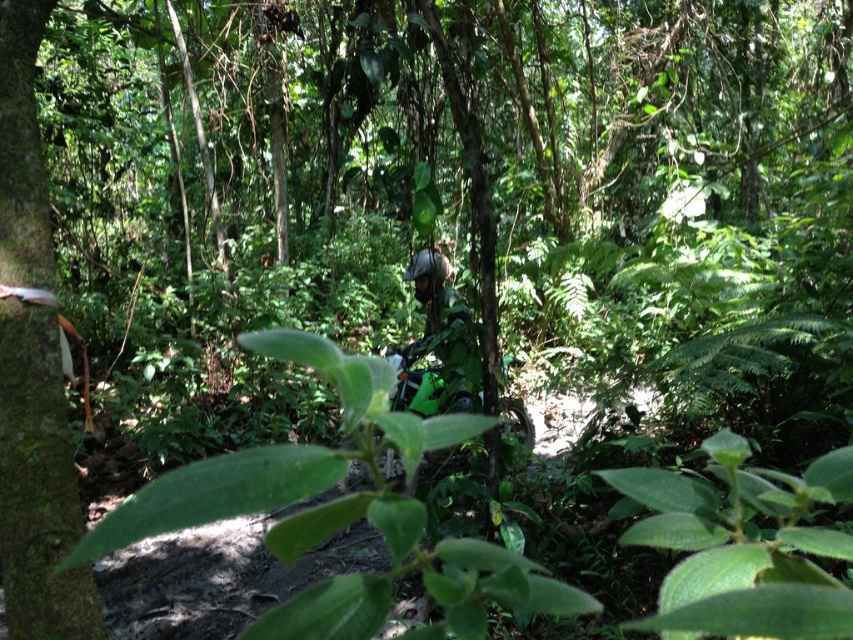
Question: Which point is farther from the camera taking this photo?

Choices:
 (A) (38, 577)
 (B) (424, 298)

Answer: (B)

Question: Is green mossy tree trunk at left behind green matte motorcycle at center?

Choices:
 (A) yes
 (B) no

Answer: (B)

Question: Which of the following is the closest to the observer?

Choices:
 (A) (4, 381)
 (B) (442, 276)

Answer: (A)

Question: Which object appears farthest from the camera in this image?

Choices:
 (A) green mossy tree trunk at left
 (B) green matte motorcycle at center

Answer: (B)

Question: Does green mossy tree trunk at left have a lesser width compared to green matte motorcycle at center?

Choices:
 (A) no
 (B) yes

Answer: (A)

Question: Can you confirm if green mossy tree trunk at left is positioned below green matte motorcycle at center?

Choices:
 (A) yes
 (B) no

Answer: (A)